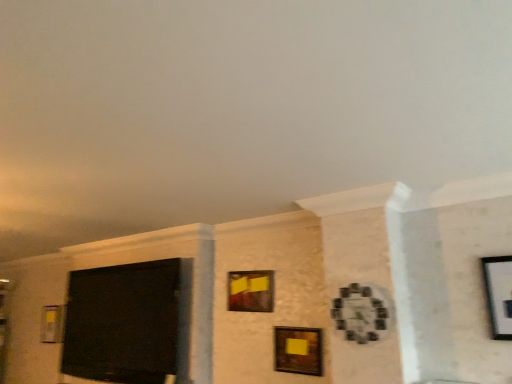
Question: Would you consider matte black picture frame at left, which is the first picture frame in back-to-front order, to be distant from matte black screen at left?

Choices:
 (A) no
 (B) yes

Answer: (A)

Question: Considering the relative sizes of matte black picture frame at left, positioned as the first picture frame in left-to-right order, and matte black screen at left in the image provided, is matte black picture frame at left, positioned as the first picture frame in left-to-right order, smaller than matte black screen at left?

Choices:
 (A) no
 (B) yes

Answer: (B)

Question: Can you confirm if matte black picture frame at left, which is the fourth picture frame from right to left, is wider than matte black screen at left?

Choices:
 (A) yes
 (B) no

Answer: (B)

Question: From the image's perspective, is matte black picture frame at left, which is the first picture frame in back-to-front order, located above matte black screen at left?

Choices:
 (A) yes
 (B) no

Answer: (B)

Question: Is matte black picture frame at left, positioned as the first picture frame in left-to-right order, in front of matte black screen at left?

Choices:
 (A) yes
 (B) no

Answer: (B)

Question: Is matte black picture frame at left, which ranks as the 4th picture frame in front-to-back order, oriented towards matte black screen at left?

Choices:
 (A) yes
 (B) no

Answer: (B)

Question: From a real-world perspective, is matte black screen at left below wooden clock at center-right, the first picture frame viewed from the right?

Choices:
 (A) no
 (B) yes

Answer: (B)

Question: Is matte black screen at left next to wooden clock at center-right, the first picture frame viewed from the right?

Choices:
 (A) no
 (B) yes

Answer: (A)

Question: From the image's perspective, does matte black screen at left appear lower than wooden clock at center-right, which appears as the first picture frame when viewed from the front?

Choices:
 (A) yes
 (B) no

Answer: (A)

Question: Is matte black screen at left positioned behind wooden clock at center-right, arranged as the 4th picture frame when viewed from the back?

Choices:
 (A) yes
 (B) no

Answer: (A)

Question: Does matte black screen at left appear on the left side of wooden clock at center-right, which appears as the first picture frame when viewed from the front?

Choices:
 (A) yes
 (B) no

Answer: (A)

Question: Is matte black screen at left far from wooden clock at center-right, the first picture frame viewed from the right?

Choices:
 (A) no
 (B) yes

Answer: (B)

Question: Is matte wooden picture frame at center, which is the second picture frame in front-to-back order, at the left side of matte black screen at left?

Choices:
 (A) no
 (B) yes

Answer: (A)